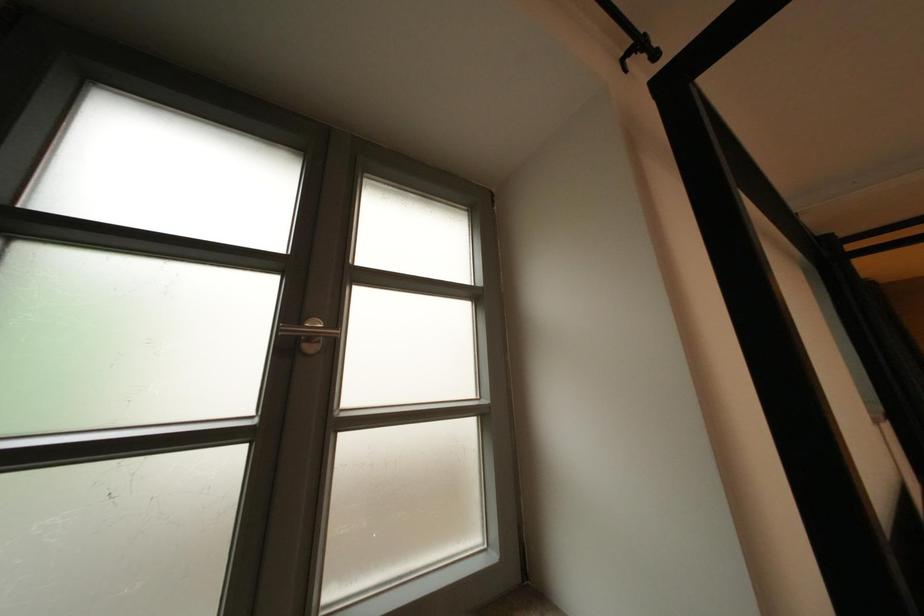
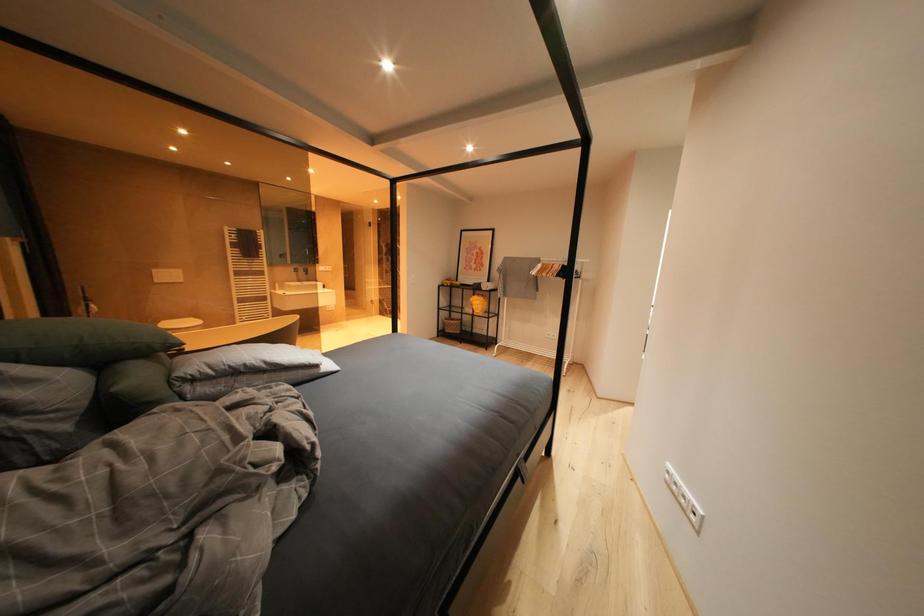
Question: Based on the continuous images, in which direction is the camera rotating? Reply with the corresponding letter.

Choices:
 (A) Left
 (B) Right
 (C) Up
 (D) Down

Answer: (B)